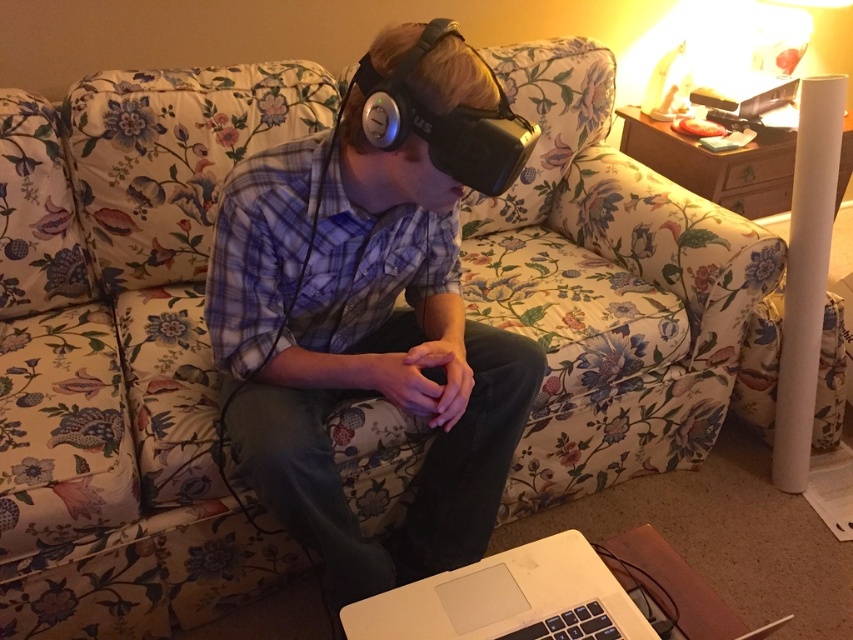
Question: Among these objects, which one is farthest from the camera?

Choices:
 (A) matte black vr headset at center
 (B) white matte laptop at lower center

Answer: (B)

Question: Which point is closer to the camera?

Choices:
 (A) (432, 595)
 (B) (491, 481)

Answer: (A)

Question: Is matte black vr headset at center wider than white matte laptop at lower center?

Choices:
 (A) yes
 (B) no

Answer: (A)

Question: Can you confirm if matte black vr headset at center is smaller than white matte laptop at lower center?

Choices:
 (A) yes
 (B) no

Answer: (B)

Question: Is matte black vr headset at center bigger than white matte laptop at lower center?

Choices:
 (A) no
 (B) yes

Answer: (B)